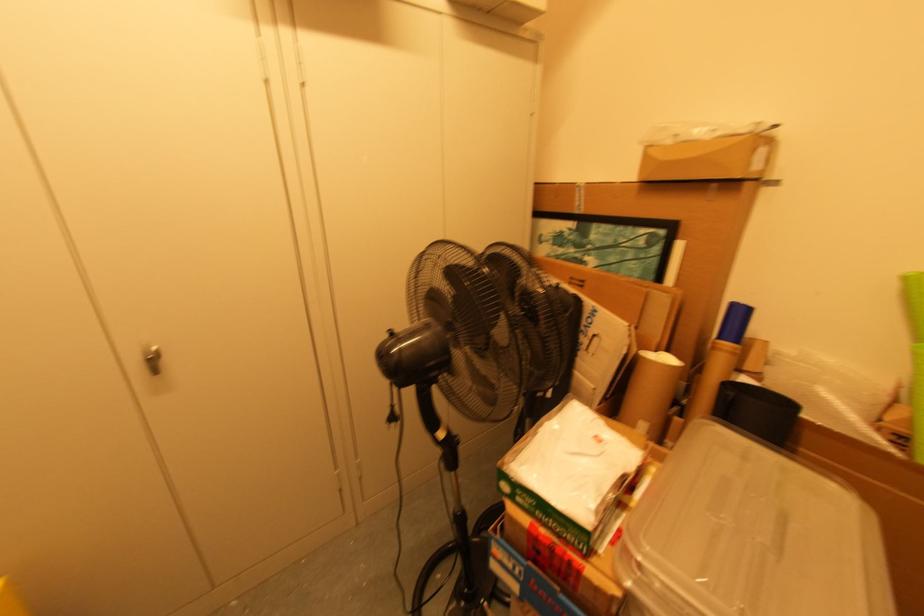
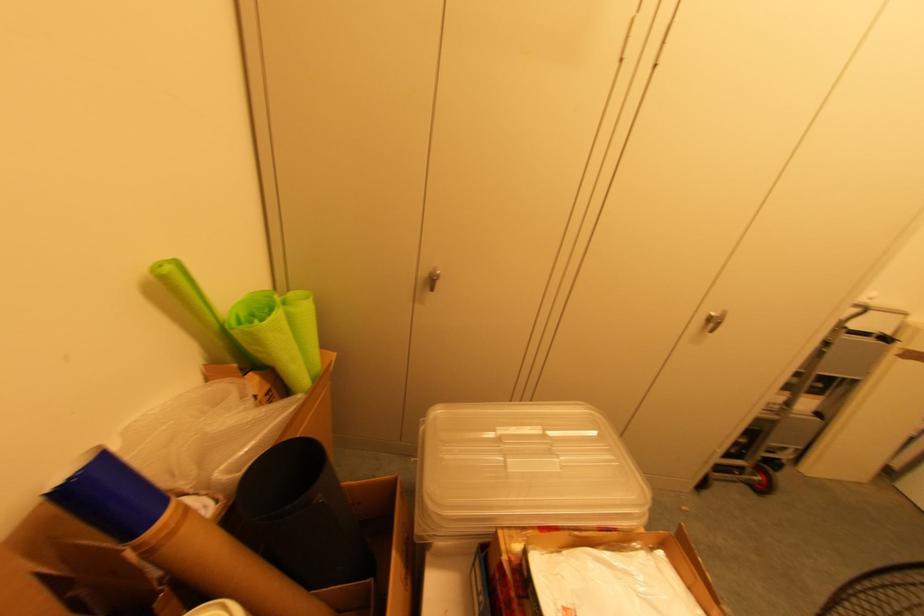
Locate, in the second image, the point that corresponds to [716,347] in the first image.

(152, 551)